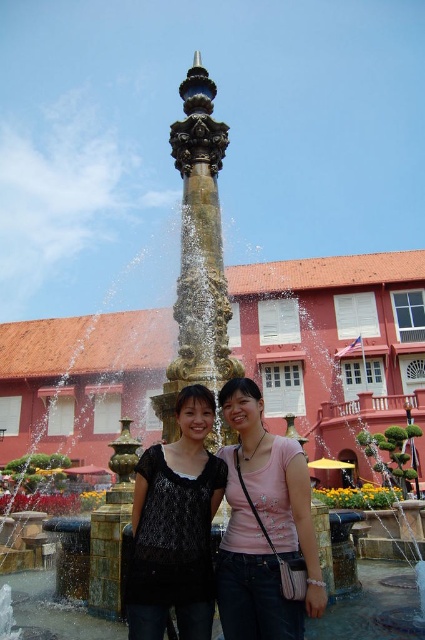
Question: Among these points, which one is farthest from the camera?

Choices:
 (A) (260, 490)
 (B) (209, 348)

Answer: (B)

Question: Can you confirm if matte black top at center is wider than gold textured fountain at center?

Choices:
 (A) no
 (B) yes

Answer: (A)

Question: Estimate the real-world distances between objects in this image. Which object is closer to the matte black shirt at center?

Choices:
 (A) gold textured fountain at center
 (B) matte black top at center

Answer: (B)

Question: Where is matte black shirt at center located in relation to gold textured fountain at center in the image?

Choices:
 (A) below
 (B) above

Answer: (A)

Question: Does matte black top at center have a smaller size compared to gold textured fountain at center?

Choices:
 (A) no
 (B) yes

Answer: (B)

Question: Which point appears closest to the camera in this image?

Choices:
 (A) (164, 492)
 (B) (204, 330)

Answer: (A)